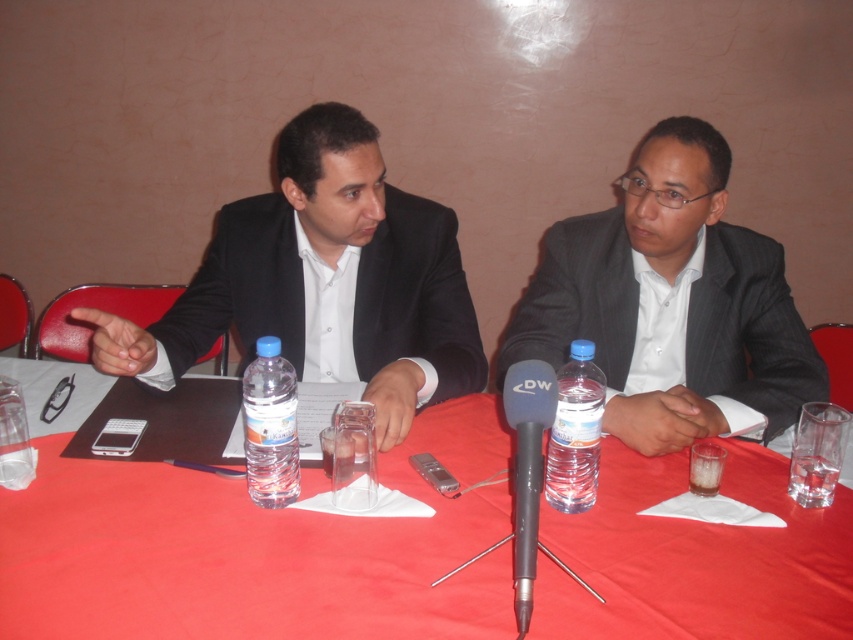
Can you confirm if clear plastic bottle at center is positioned to the left of clear plastic water bottle at center?

Yes, clear plastic bottle at center is to the left of clear plastic water bottle at center.

Can you confirm if clear plastic bottle at center is positioned to the right of clear plastic water bottle at center?

In fact, clear plastic bottle at center is to the left of clear plastic water bottle at center.

Which is in front, point (259, 429) or point (556, 422)?

Point (259, 429)

Where is `clear plastic bottle at center`? clear plastic bottle at center is located at coordinates (270, 426).

Which is behind, point (683, 532) or point (531, 596)?

Positioned behind is point (683, 532).

Can you confirm if red cloth table at center is smaller than black matte microphone at center?

Incorrect, red cloth table at center is not smaller in size than black matte microphone at center.

Which is in front, point (1, 369) or point (521, 481)?

Point (521, 481)

What are the coordinates of `red cloth table at center` in the screenshot? It's located at (257, 548).

What do you see at coordinates (671, 300) in the screenshot? I see `matte gray suit at center` at bounding box center [671, 300].

This screenshot has width=853, height=640. Describe the element at coordinates (671, 300) in the screenshot. I see `matte gray suit at center` at that location.

You are a GUI agent. You are given a task and a screenshot of the screen. Output one action in this format:
    pyautogui.click(x=<x>, y=<y>)
    Task: Click on the matte gray suit at center
    
    Given the screenshot: What is the action you would take?
    pyautogui.click(x=671, y=300)